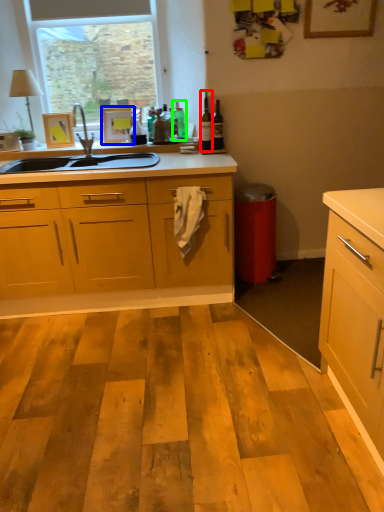
Question: Which object is the farthest from bottle (highlighted by a red box)? Choose among these: picture frame (highlighted by a blue box) or bottle (highlighted by a green box).

Choices:
 (A) picture frame
 (B) bottle

Answer: (A)